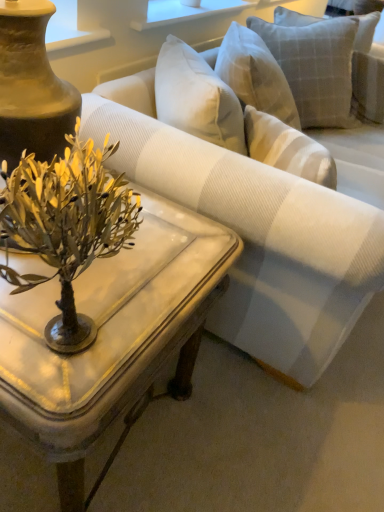
This screenshot has width=384, height=512. I want to click on free space behind metallic gold plant at center, so click(x=165, y=236).